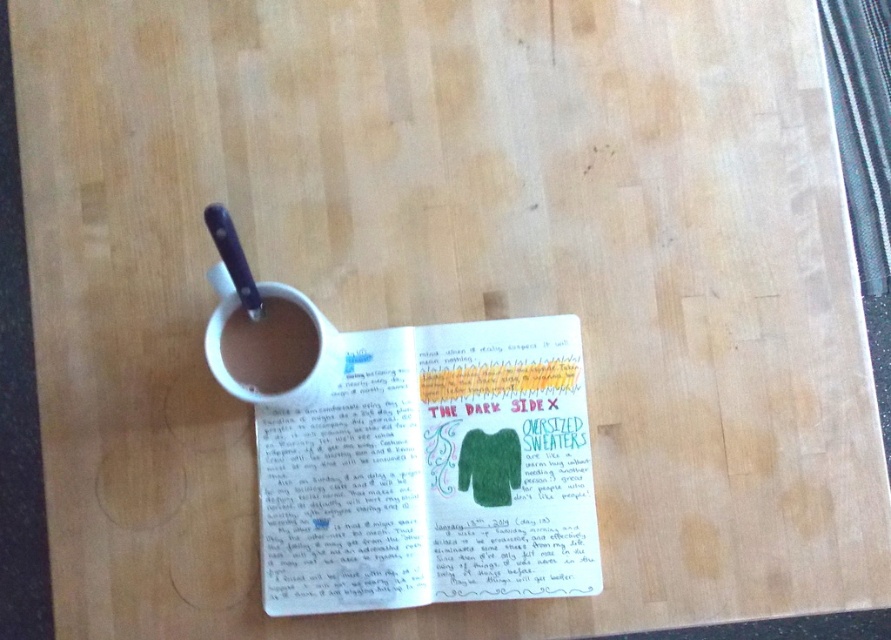
You are standing 5 feet away from the white paper at center. If you want to take a photo of it, will you need to move closer or farther away?

The white paper at center is 27.38 inches from the camera. Since you are standing 5 feet away, which is 60 inches, you need to move closer to the white paper at center to take a photo.

You are organizing a craft fair and need to place a sticker on the white paper at center. The sticker has coordinates marked as point [432,472]. Where should you place the sticker on the white paper at center?

The sticker should be placed at point [432,472] on the white paper at center.